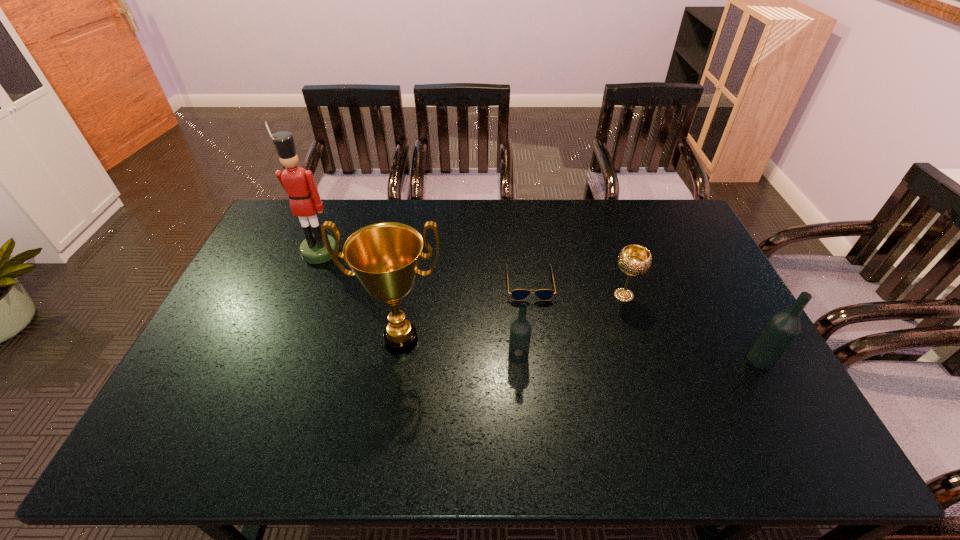
At what (x,y) coordinates should I click in order to perform the action: click on free space located 0.190m on the front-facing side of the farthest object. Please return your answer as a coordinate pair (x, y). The height and width of the screenshot is (540, 960). Looking at the image, I should click on (299, 307).

Locate an element on the screen. The image size is (960, 540). vacant space located 0.250m on the front-facing side of the shortest object is located at coordinates tap(540, 370).

Find the location of `vacant region located on the back of the fifth object from left to right`. vacant region located on the back of the fifth object from left to right is located at coordinates (596, 211).

Locate an element on the screen. The image size is (960, 540). free space located on the front view with handles of the fifth object from right to left is located at coordinates (393, 390).

Locate an element on the screen. object present at the right edge is located at coordinates (782, 329).

Find the location of a particular element. The image size is (960, 540). vacant area at the far edge of the desktop is located at coordinates 569,233.

Where is `vacant space at the near edge of the desktop`? Image resolution: width=960 pixels, height=540 pixels. vacant space at the near edge of the desktop is located at coordinates (276, 413).

The height and width of the screenshot is (540, 960). I want to click on free location at the left edge, so click(276, 281).

Identify the location of vacant space at the right edge. This screenshot has width=960, height=540. (681, 240).

In the image, there is a desktop. Where is `blank space at the far left corner`? This screenshot has width=960, height=540. blank space at the far left corner is located at coordinates (264, 237).